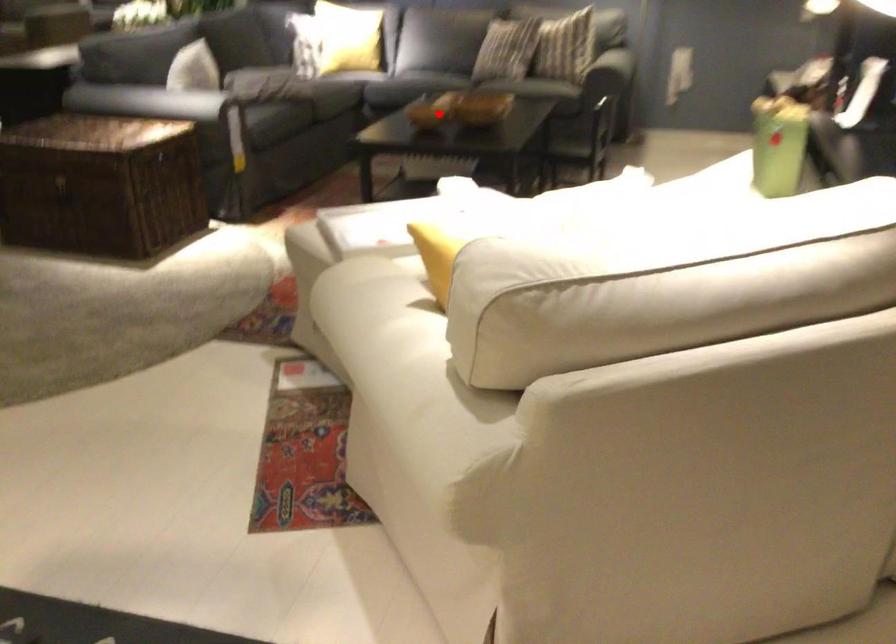
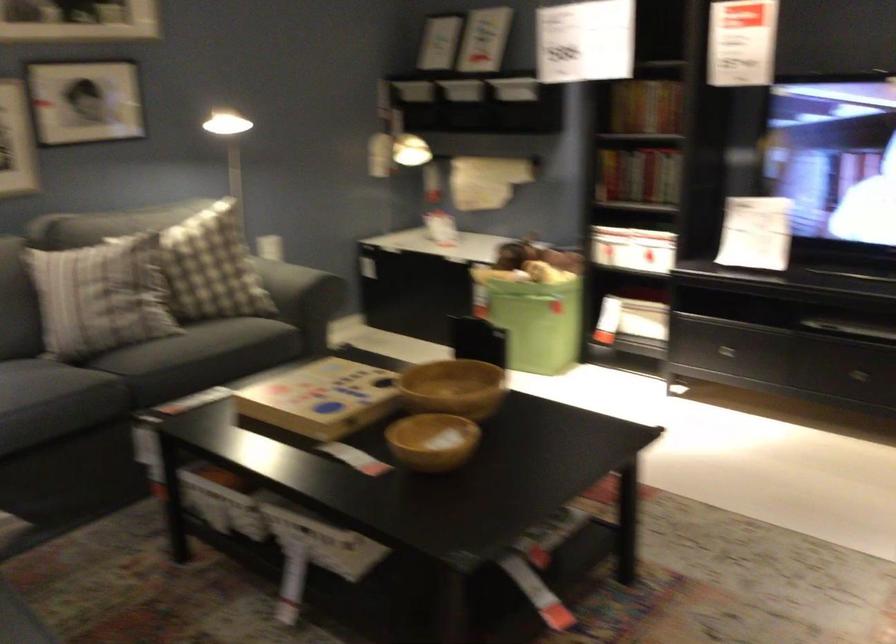
Find the pixel in the second image that matches the highlighted location in the first image.

(433, 440)